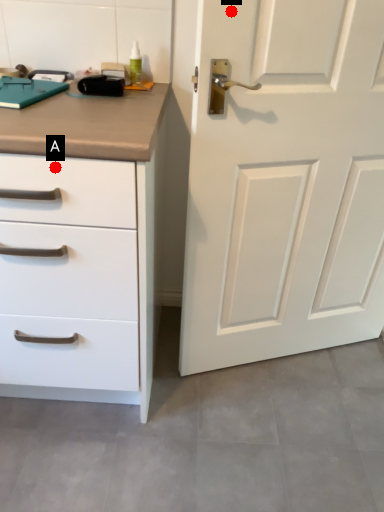
Question: Two points are circled on the image, labeled by A and B beside each circle. Which point is closer to the camera?

Choices:
 (A) A is closer
 (B) B is closer

Answer: (A)